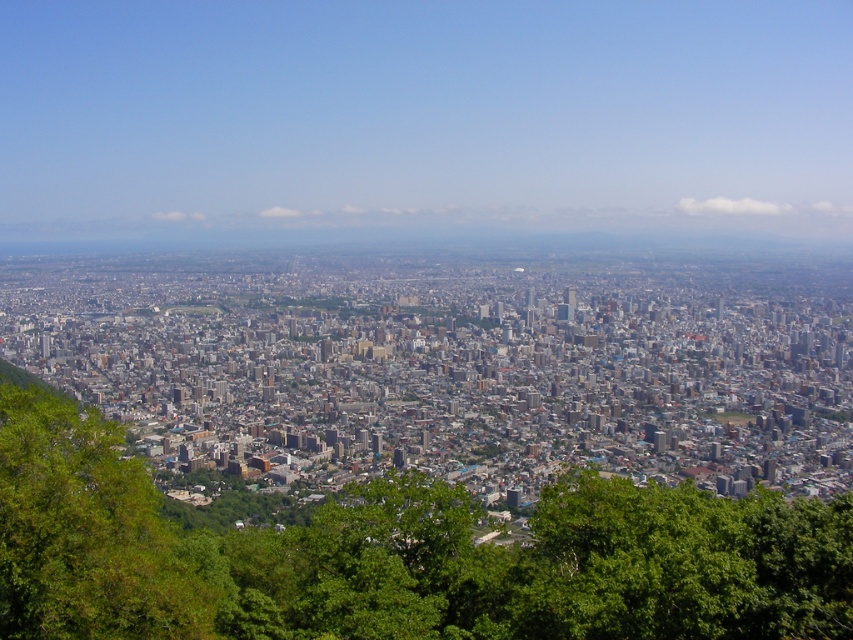
Where is `green leafy tree at center`? green leafy tree at center is located at coordinates (398, 556).

Is green leafy tree at center taller than green leafy tree at lower left?

Indeed, green leafy tree at center has a greater height compared to green leafy tree at lower left.

Describe the element at coordinates (398, 556) in the screenshot. I see `green leafy tree at center` at that location.

The image size is (853, 640). Identify the location of green leafy tree at center. (398, 556).